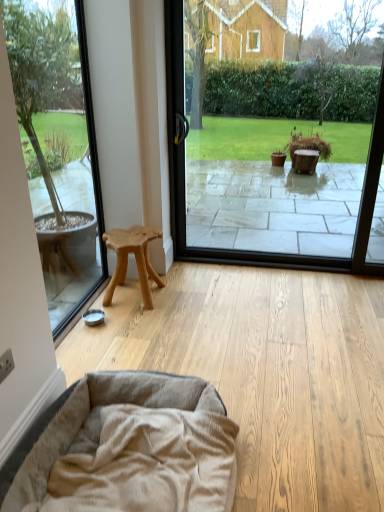
Where is `vacant point above natural wood stool at left (from a real-world perspective)`? The image size is (384, 512). vacant point above natural wood stool at left (from a real-world perspective) is located at coordinates (127, 234).